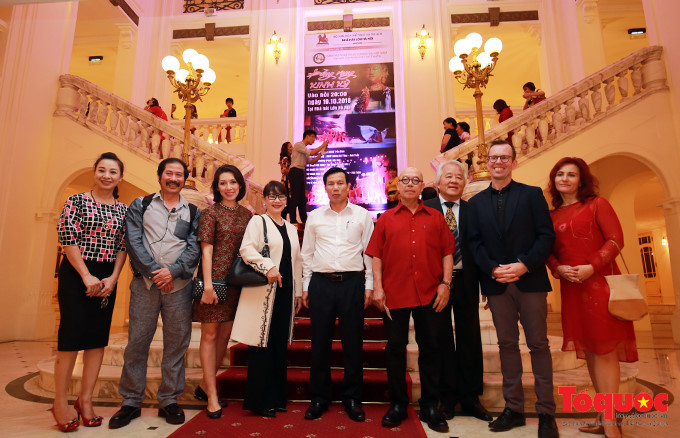
Where is `staircase on right`? staircase on right is located at coordinates (596, 119).